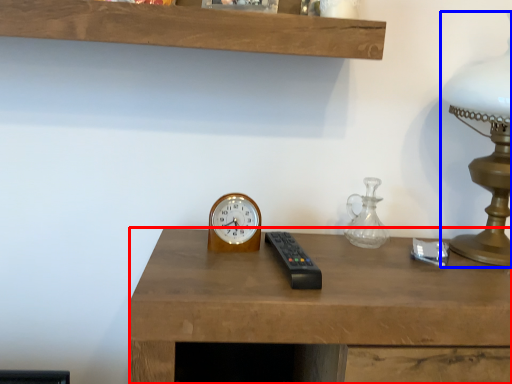
Question: Which object appears farthest to the camera in this image, desk (highlighted by a red box) or table lamp (highlighted by a blue box)?

Choices:
 (A) desk
 (B) table lamp

Answer: (B)